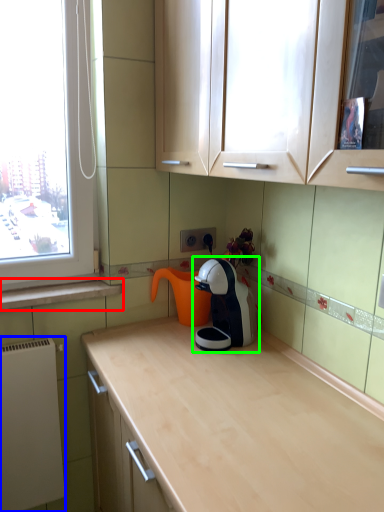
Question: Which object is positioned closest to window sill (highlighted by a red box)? Select from appliance (highlighted by a blue box) and home appliance (highlighted by a green box).

Choices:
 (A) appliance
 (B) home appliance

Answer: (A)